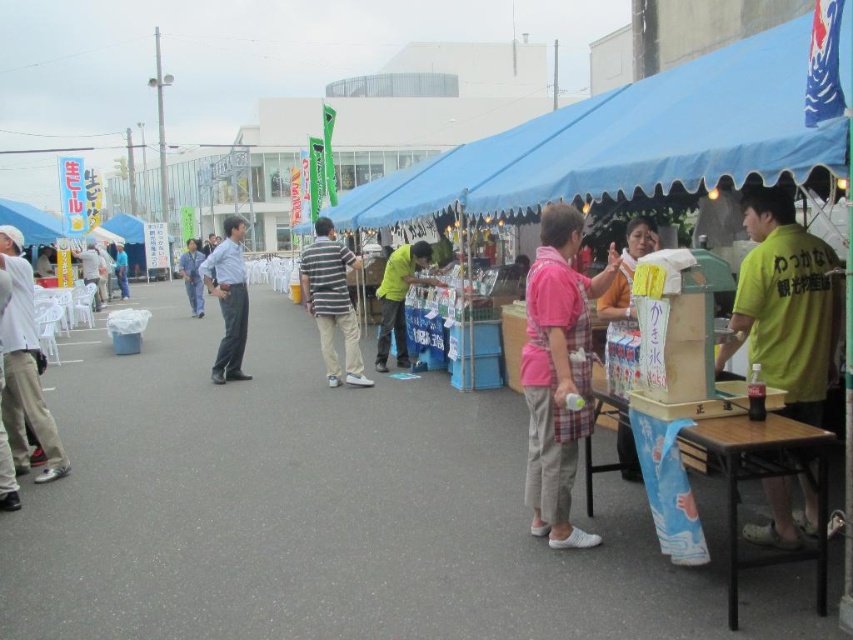
You are a customer at the outdoor market and want to buy a drink from the vendor. The vendor is standing at the center of the market. You are currently at point (x=556, y=372). Which direction should you walk to reach the vendor?

The pink fabric shirt at center is located at the center of the market, so you should walk towards the center from your current position at point (x=556, y=372) to reach the vendor.

You are a customer at the market and notice two items of clothing at the center of the image. The striped cotton shirt at center and the blue denim jeans at center. Which item is located above the other?

The striped cotton shirt at center is positioned under blue denim jeans at center, so the blue denim jeans at center are above the striped cotton shirt at center.

You are a customer at the outdoor market and want to buy a drink from the vendor. You notice two items of clothing at the center of the scene. Which item of clothing is smaller in size between the striped cotton shirt at center and the blue denim jeans at center?

The striped cotton shirt at center has a smaller size compared to the blue denim jeans at center, so the striped cotton shirt at center is the smaller one.